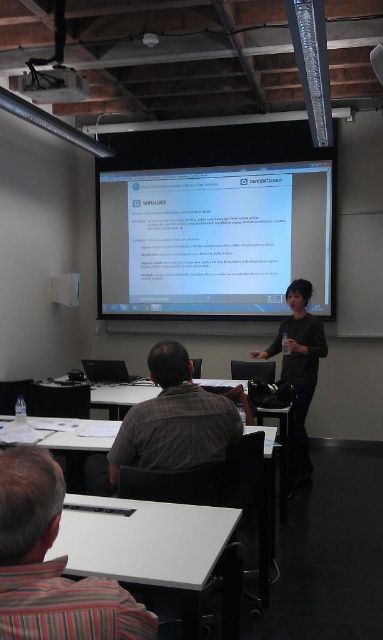
Question: Is the position of black matte shirt at center less distant than that of metallic projector at upper center?

Choices:
 (A) no
 (B) yes

Answer: (A)

Question: Can you confirm if striped fabric shirt at lower left is positioned to the right of metallic projector at upper center?

Choices:
 (A) yes
 (B) no

Answer: (A)

Question: Is white glossy projector screen at upper center closer to camera compared to metallic projector at upper center?

Choices:
 (A) no
 (B) yes

Answer: (A)

Question: Which object is closer to the camera taking this photo?

Choices:
 (A) striped fabric shirt at lower left
 (B) metallic projector at upper center
 (C) plaid fabric shirt at center

Answer: (A)

Question: Which of the following is the farthest from the observer?

Choices:
 (A) metallic projector at upper center
 (B) black matte shirt at center
 (C) striped fabric shirt at lower left
 (D) plaid fabric shirt at center

Answer: (B)

Question: Which object appears farthest from the camera in this image?

Choices:
 (A) white glossy projector screen at upper center
 (B) plaid fabric shirt at center
 (C) striped fabric shirt at lower left

Answer: (A)